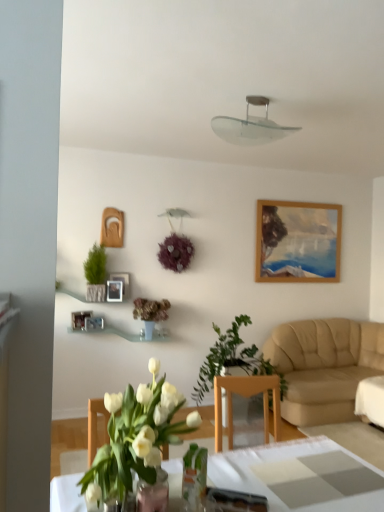
Question: Considering the relative sizes of translucent glass vase at center, the fourth houseplant in the front-to-back sequence, and wooden photo frame at upper center, which ranks as the second picture frame in right-to-left order, in the image provided, is translucent glass vase at center, the fourth houseplant in the front-to-back sequence, bigger than wooden photo frame at upper center, which ranks as the second picture frame in right-to-left order,?

Choices:
 (A) yes
 (B) no

Answer: (A)

Question: Is wooden photo frame at upper center, which ranks as the second picture frame in right-to-left order, located within translucent glass vase at center, which is counted as the 1th houseplant, starting from the back?

Choices:
 (A) yes
 (B) no

Answer: (B)

Question: Is translucent glass vase at center, which is counted as the 1th houseplant, starting from the back, oriented away from wooden photo frame at upper center, which ranks as the second picture frame in right-to-left order?

Choices:
 (A) yes
 (B) no

Answer: (B)

Question: Does translucent glass vase at center, which is counted as the 1th houseplant, starting from the back, lie in front of wooden photo frame at upper center, the second picture frame when ordered from left to right?

Choices:
 (A) no
 (B) yes

Answer: (B)

Question: Can you confirm if translucent glass vase at center, marked as the second houseplant in a left-to-right arrangement, is shorter than wooden photo frame at upper center, which ranks as the second picture frame in right-to-left order?

Choices:
 (A) no
 (B) yes

Answer: (A)

Question: From a real-world perspective, is translucent glass vase at center, the fourth houseplant in the front-to-back sequence, located higher than wooden photo frame at upper center, the second picture frame when ordered from left to right?

Choices:
 (A) no
 (B) yes

Answer: (A)

Question: Is beige leather couch at right outside wooden photo frame at upper left, arranged as the third picture frame when viewed from the right?

Choices:
 (A) no
 (B) yes

Answer: (B)

Question: Does beige leather couch at right appear on the right side of wooden photo frame at upper left, which is the 1th picture frame from left to right?

Choices:
 (A) no
 (B) yes

Answer: (B)

Question: Does beige leather couch at right lie behind wooden photo frame at upper left, arranged as the third picture frame when viewed from the right?

Choices:
 (A) yes
 (B) no

Answer: (B)

Question: Can you confirm if beige leather couch at right is bigger than wooden photo frame at upper left, arranged as the third picture frame when viewed from the right?

Choices:
 (A) no
 (B) yes

Answer: (B)

Question: Does beige leather couch at right have a greater height compared to wooden photo frame at upper left, arranged as the third picture frame when viewed from the right?

Choices:
 (A) no
 (B) yes

Answer: (B)

Question: From the image's perspective, does beige leather couch at right appear higher than wooden photo frame at upper left, which is the 1th picture frame from left to right?

Choices:
 (A) yes
 (B) no

Answer: (B)

Question: Is wooden photo frame at upper left, marked as the 3th picture frame in a left-to-right arrangement, wider than clear glass lampshade at upper center?

Choices:
 (A) no
 (B) yes

Answer: (A)